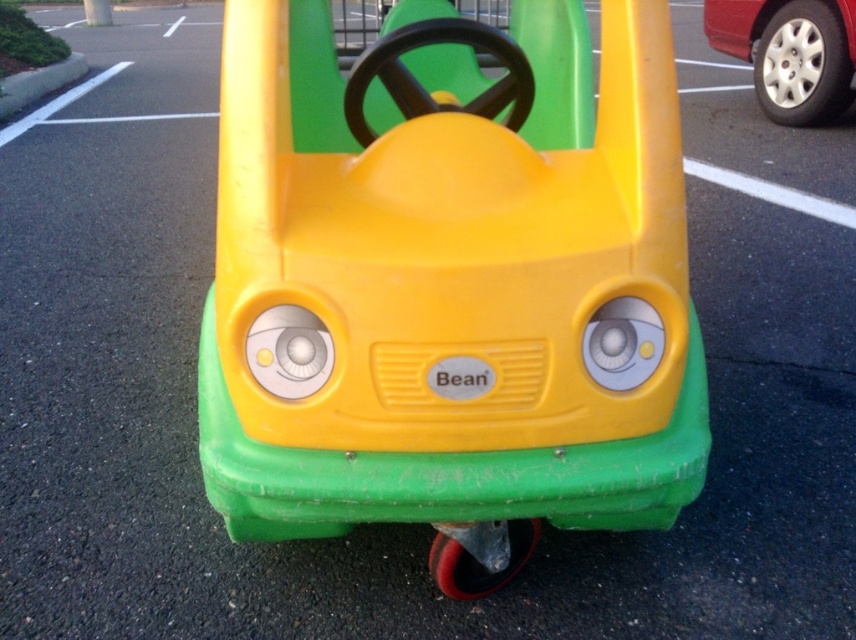
Who is positioned more to the left, yellow plastic toy car at center or metallic silver wheel at upper right?

From the viewer's perspective, yellow plastic toy car at center appears more on the left side.

At what (x,y) coordinates should I click in order to perform the action: click on yellow plastic toy car at center. Please return your answer as a coordinate pair (x, y). The image size is (856, 640). Looking at the image, I should click on (450, 282).